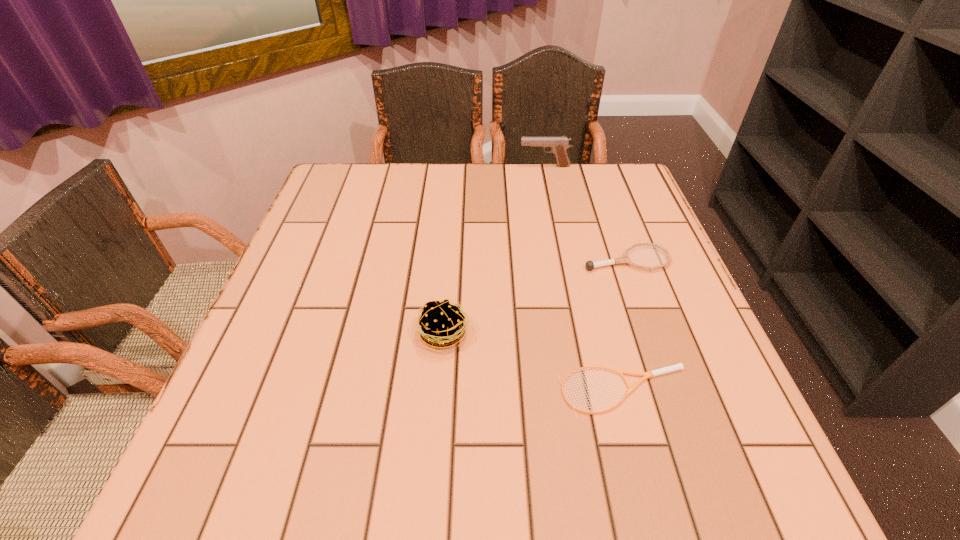
In the image, there is a desktop. Where is `vacant space at the far right corner`? This screenshot has height=540, width=960. vacant space at the far right corner is located at coordinates (595, 168).

The image size is (960, 540). I want to click on vacant area between the shorter tennis racket and the third shortest object, so click(534, 363).

This screenshot has width=960, height=540. What are the coordinates of `unoccupied area between the taller tennis racket and the patty` in the screenshot? It's located at (535, 297).

Where is `vacant region between the shorter tennis racket and the patty`? The image size is (960, 540). vacant region between the shorter tennis racket and the patty is located at coordinates (534, 363).

At what (x,y) coordinates should I click in order to perform the action: click on empty space that is in between the tallest object and the nearest object. Please return your answer as a coordinate pair (x, y). The width and height of the screenshot is (960, 540). Looking at the image, I should click on (585, 279).

You are a GUI agent. You are given a task and a screenshot of the screen. Output one action in this format:
    pyautogui.click(x=<x>, y=<y>)
    Task: Click on the vacant point located between the patty and the tallest object
    The height and width of the screenshot is (540, 960).
    Given the screenshot: What is the action you would take?
    pyautogui.click(x=494, y=250)

The height and width of the screenshot is (540, 960). I want to click on unoccupied area between the farther tennis racket and the pistol, so click(586, 213).

Locate an element on the screen. The image size is (960, 540). vacant space that is in between the shorter tennis racket and the leftmost object is located at coordinates (534, 363).

The image size is (960, 540). Find the location of `free spot between the tallest object and the second tallest object`. free spot between the tallest object and the second tallest object is located at coordinates (494, 250).

Locate an element on the screen. This screenshot has height=540, width=960. free space between the farthest object and the nearest object is located at coordinates (585, 279).